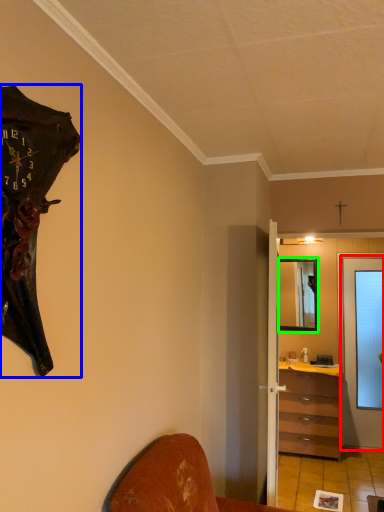
Question: Which is farther away from door (highlighted by a red box)? wall clock (highlighted by a blue box) or mirror (highlighted by a green box)?

Choices:
 (A) wall clock
 (B) mirror

Answer: (A)